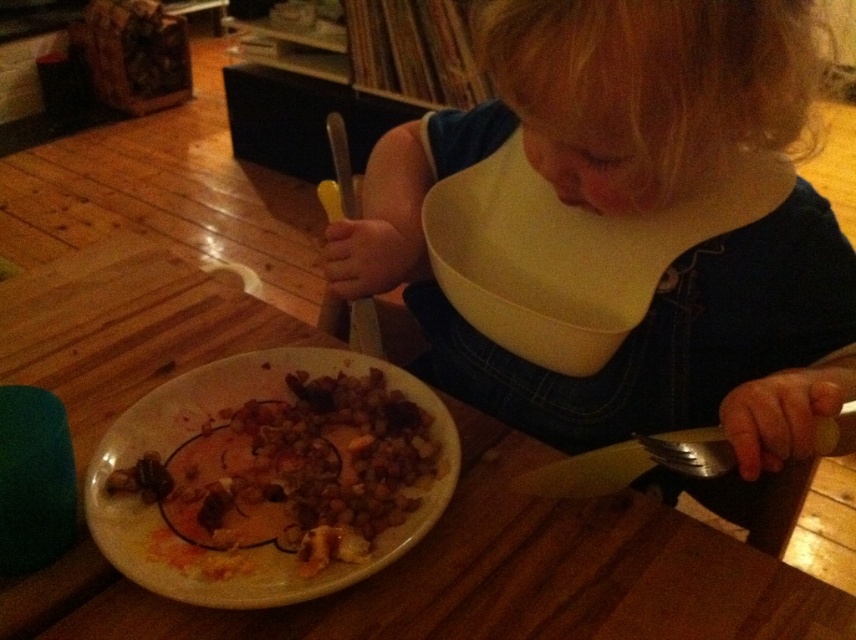
You are a delivery robot with a height of 24 inches. You need to deliver a package to the dining area shown in the image. There is a point at coordinates point (488, 477) that you must pass through. Can you safely navigate through that point without hitting your head?

The distance of point (488, 477) from camera is 23.90 inches. Since the delivery robot is 24 inches tall, it is slightly taller than the clearance available at that point. Therefore, the robot may hit its head if it navigates through that point.